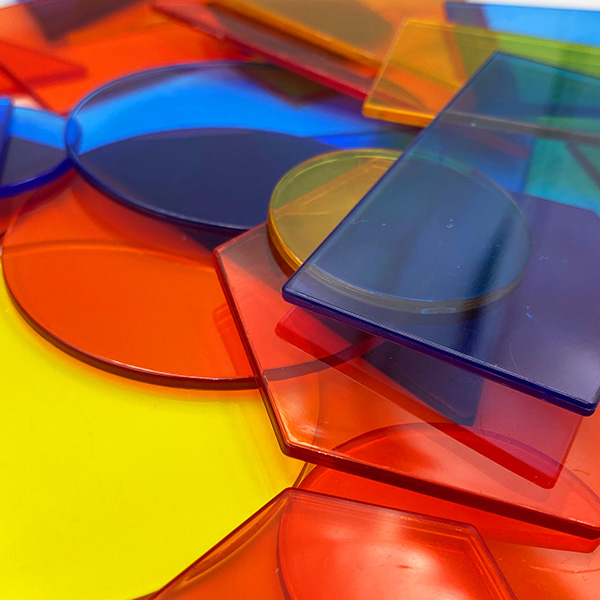
Locate an element on the screen. The image size is (600, 600). glass is located at coordinates (518, 351).